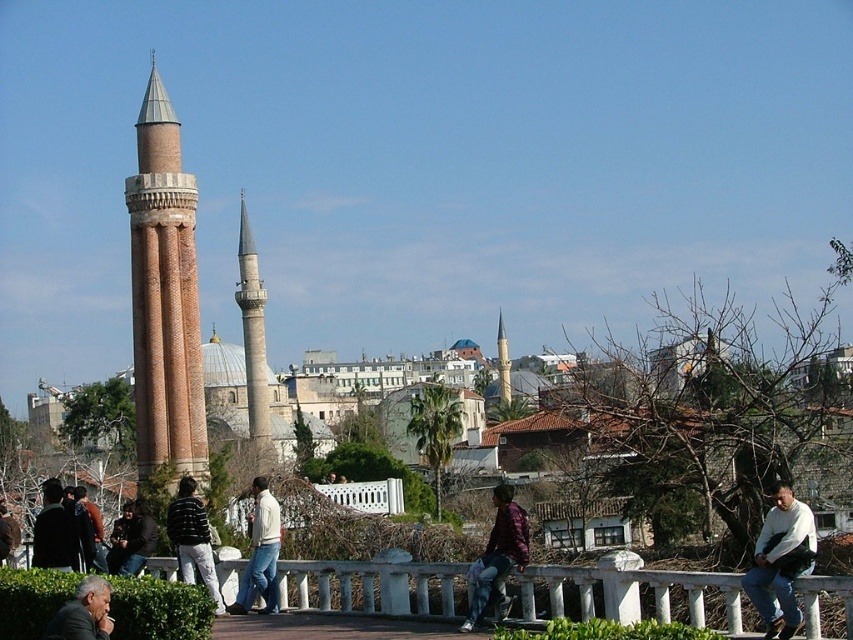
Question: Considering the real-world distances, which object is farthest from the striped sweater at center?

Choices:
 (A) smooth gray minaret at center
 (B) white stone pillar at center
 (C) green leafy hedge at lower left

Answer: (A)

Question: Does white stone railing at center have a lesser width compared to smooth stone minaret at center?

Choices:
 (A) no
 (B) yes

Answer: (A)

Question: Which of the following is the farthest from the observer?

Choices:
 (A) (480, 566)
 (B) (151, 627)

Answer: (A)

Question: Is white fleece jacket at lower right to the right of maroon textured shirt at center from the viewer's perspective?

Choices:
 (A) yes
 (B) no

Answer: (A)

Question: Which of the following is the closest to the observer?

Choices:
 (A) smooth gray minaret at center
 (B) white fleece jacket at lower right
 (C) light beige sweater at center

Answer: (B)

Question: Does brick tower at left have a greater width compared to green leafy hedge at lower left?

Choices:
 (A) no
 (B) yes

Answer: (B)